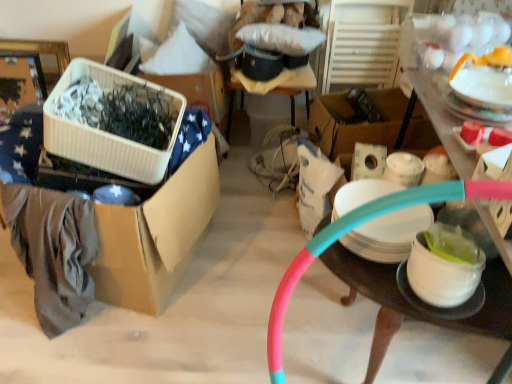
Question: From the image's perspective, does pink rubber hose at right appear higher than pink rubber hoop at center, the 4th storage box positioned from the left?

Choices:
 (A) yes
 (B) no

Answer: (B)

Question: From the image's perspective, is pink rubber hose at right located beneath pink rubber hoop at center, the 4th storage box positioned from the left?

Choices:
 (A) yes
 (B) no

Answer: (A)

Question: Is pink rubber hose at right not near pink rubber hoop at center, the 4th storage box positioned from the left?

Choices:
 (A) yes
 (B) no

Answer: (B)

Question: Does pink rubber hose at right have a greater height compared to pink rubber hoop at center, the 4th storage box positioned from the left?

Choices:
 (A) yes
 (B) no

Answer: (A)

Question: Is pink rubber hose at right positioned behind pink rubber hoop at center, positioned as the 1th storage box in right-to-left order?

Choices:
 (A) no
 (B) yes

Answer: (B)

Question: In terms of size, does cardboard box at left, the fourth storage box positioned from the right, appear bigger or smaller than white plastic storage box at upper center, arranged as the second storage box when viewed from the right?

Choices:
 (A) small
 (B) big

Answer: (B)

Question: From a real-world perspective, relative to white plastic storage box at upper center, which is the 3th storage box from left to right, is cardboard box at left, arranged as the first storage box when viewed from the left, vertically above or below?

Choices:
 (A) below
 (B) above

Answer: (A)

Question: In the image, is cardboard box at left, arranged as the first storage box when viewed from the left, positioned in front of or behind white plastic storage box at upper center, arranged as the second storage box when viewed from the right?

Choices:
 (A) front
 (B) behind

Answer: (A)

Question: In terms of height, does cardboard box at left, arranged as the first storage box when viewed from the left, look taller or shorter compared to white plastic storage box at upper center, arranged as the second storage box when viewed from the right?

Choices:
 (A) short
 (B) tall

Answer: (B)

Question: From a real-world perspective, is white glossy teapot at upper right, marked as the third tableware in a left-to-right arrangement, above or below cardboard box at left, the fourth storage box positioned from the right?

Choices:
 (A) above
 (B) below

Answer: (A)

Question: Looking at their shapes, would you say white glossy teapot at upper right, which is counted as the 1th tableware, starting from the right, is wider or thinner than cardboard box at left, the fourth storage box positioned from the right?

Choices:
 (A) wide
 (B) thin

Answer: (B)

Question: Considering the positions of white glossy teapot at upper right, marked as the third tableware in a left-to-right arrangement, and cardboard box at left, the fourth storage box positioned from the right, in the image, is white glossy teapot at upper right, marked as the third tableware in a left-to-right arrangement, taller or shorter than cardboard box at left, the fourth storage box positioned from the right,?

Choices:
 (A) short
 (B) tall

Answer: (A)

Question: From the image's perspective, relative to cardboard box at left, arranged as the first storage box when viewed from the left, is white glossy teapot at upper right, marked as the 1th tableware in a top-to-bottom arrangement, above or below?

Choices:
 (A) above
 (B) below

Answer: (A)

Question: Choose the correct answer: Is pink rubber hoop at center, positioned as the 1th storage box in right-to-left order, inside white glossy bowl at lower right, placed as the second tableware when sorted from left to right, or outside it?

Choices:
 (A) inside
 (B) outside

Answer: (B)

Question: Considering their positions, is pink rubber hoop at center, the 4th storage box positioned from the left, located in front of or behind white glossy bowl at lower right, the second tableware viewed from the right?

Choices:
 (A) front
 (B) behind

Answer: (A)